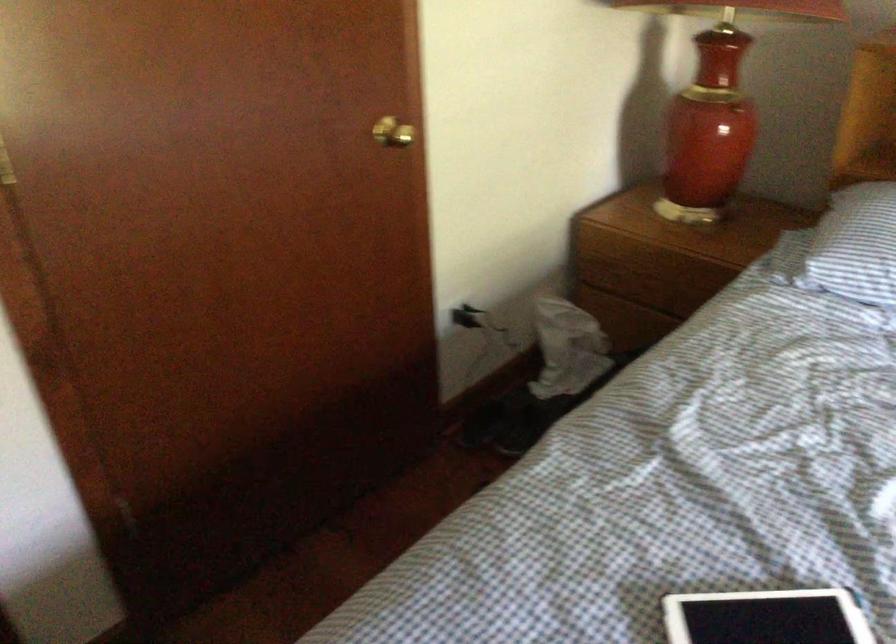
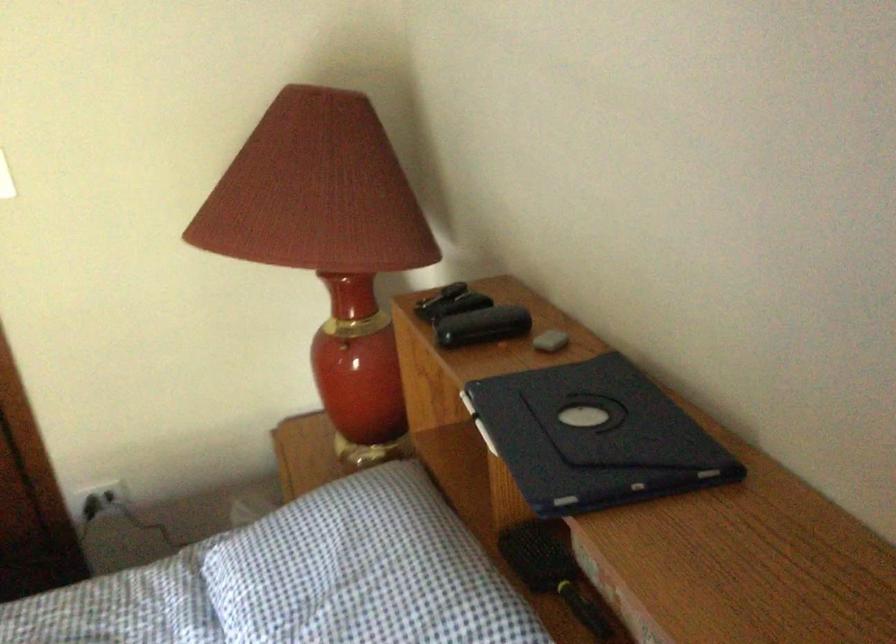
Question: I am providing you with two images of the same scene from different viewpoints. Which of the following objects are not visible in image2?

Choices:
 (A) wall outlet
 (B) nightstand drawer pull
 (C) black hairbrush
 (D) metal dispenser lever

Answer: (B)